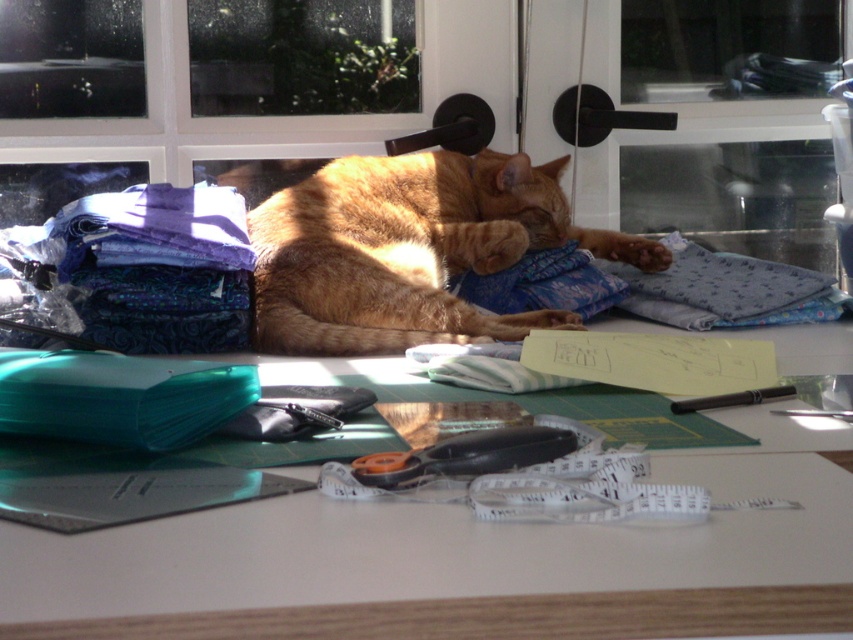
What do you see at coordinates (467, 561) in the screenshot? I see `white glossy table at center` at bounding box center [467, 561].

Between white glossy table at center and purple fabric at left, which one appears on the right side from the viewer's perspective?

white glossy table at center

What do you see at coordinates (467, 561) in the screenshot?
I see `white glossy table at center` at bounding box center [467, 561].

This screenshot has width=853, height=640. I want to click on white glossy table at center, so click(x=467, y=561).

Does orange fur cat at center have a smaller size compared to blue fabric at center?

No, orange fur cat at center is not smaller than blue fabric at center.

Looking at this image, which of these two, orange fur cat at center or blue fabric at center, stands shorter?

Standing shorter between the two is blue fabric at center.

Is point (283, 269) closer to viewer compared to point (668, 272)?

Yes, it is.

Image resolution: width=853 pixels, height=640 pixels. In order to click on orange fur cat at center in this screenshot , I will do (x=410, y=250).

Is white glossy table at center further to camera compared to orange fur cat at center?

That is False.

From the picture: Can you confirm if white glossy table at center is positioned to the right of orange fur cat at center?

Yes, white glossy table at center is to the right of orange fur cat at center.

Who is more forward, (165, 552) or (349, 240)?

Point (165, 552)

What are the coordinates of `white glossy table at center` in the screenshot? It's located at (467, 561).